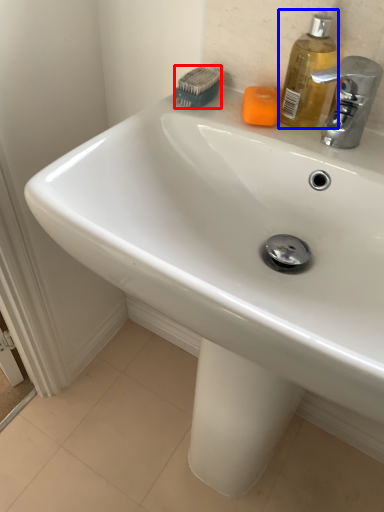
Question: Which object appears closest to the camera in this image, brush (highlighted by a red box) or soap dispenser (highlighted by a blue box)?

Choices:
 (A) brush
 (B) soap dispenser

Answer: (B)